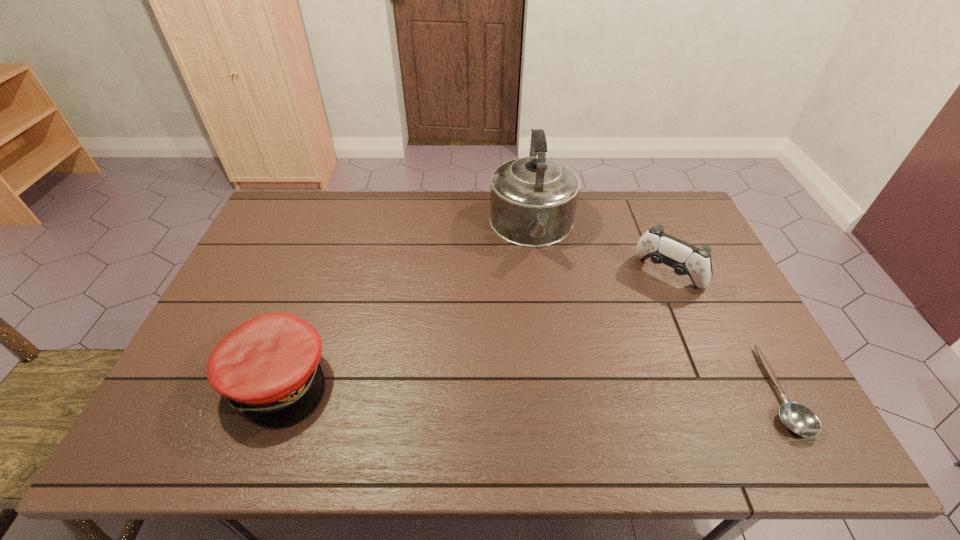
Where is `free location located 0.310m on the front-facing side of the control`? The width and height of the screenshot is (960, 540). free location located 0.310m on the front-facing side of the control is located at coordinates (599, 357).

Locate an element on the screen. The image size is (960, 540). vacant space located on the front-facing side of the control is located at coordinates (611, 343).

The height and width of the screenshot is (540, 960). Find the location of `vacant space located on the front-facing side of the control`. vacant space located on the front-facing side of the control is located at coordinates (611, 343).

Find the location of a particular element. Image resolution: width=960 pixels, height=540 pixels. vacant space situated 0.360m with the spout at the front of the kettle is located at coordinates (552, 365).

Locate an element on the screen. free space located with the spout at the front of the kettle is located at coordinates (544, 314).

Where is `free spot located with the spout at the front of the kettle`? This screenshot has width=960, height=540. free spot located with the spout at the front of the kettle is located at coordinates (546, 325).

Where is `object located in the far edge section of the desktop`? This screenshot has width=960, height=540. object located in the far edge section of the desktop is located at coordinates (533, 199).

This screenshot has width=960, height=540. I want to click on cap that is positioned at the near edge, so click(268, 367).

Find the location of a particular element. The height and width of the screenshot is (540, 960). ladle present at the near edge is located at coordinates (799, 419).

This screenshot has width=960, height=540. Identify the location of object positioned at the left edge. (268, 367).